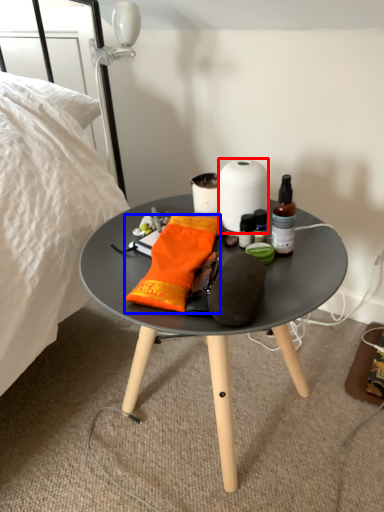
Question: Which object appears farthest to the camera in this image, paper towel (highlighted by a red box) or material (highlighted by a blue box)?

Choices:
 (A) paper towel
 (B) material

Answer: (A)